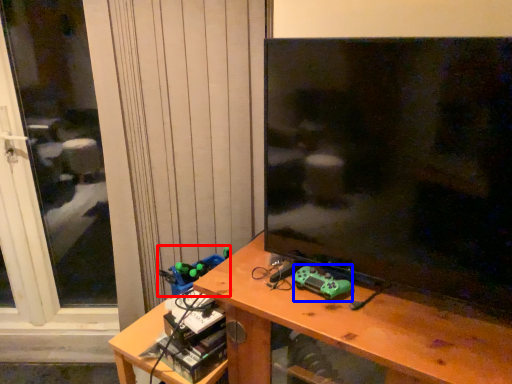
Question: Which of the following is the farthest to the observer, toy (highlighted by a red box) or toy (highlighted by a blue box)?

Choices:
 (A) toy
 (B) toy

Answer: (A)